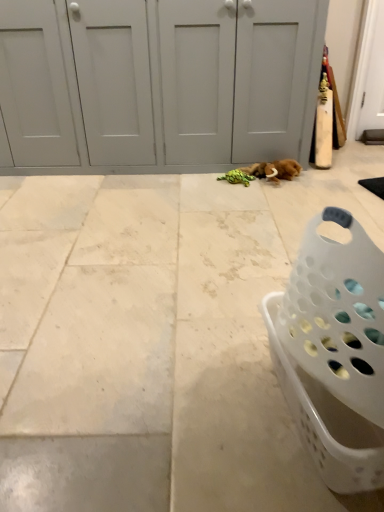
Question: Would you say white plastic laundry basket at lower right is inside or outside white tile floor at center?

Choices:
 (A) outside
 (B) inside

Answer: (A)

Question: Is white plastic laundry basket at lower right in front of or behind white tile floor at center in the image?

Choices:
 (A) behind
 (B) front

Answer: (B)

Question: Which object is the farthest from the white plastic laundry basket at lower right?

Choices:
 (A) white matte door at center
 (B) white tile floor at center

Answer: (A)

Question: Which object is the closest to the white tile floor at center?

Choices:
 (A) white matte door at center
 (B) white plastic laundry basket at lower right

Answer: (B)